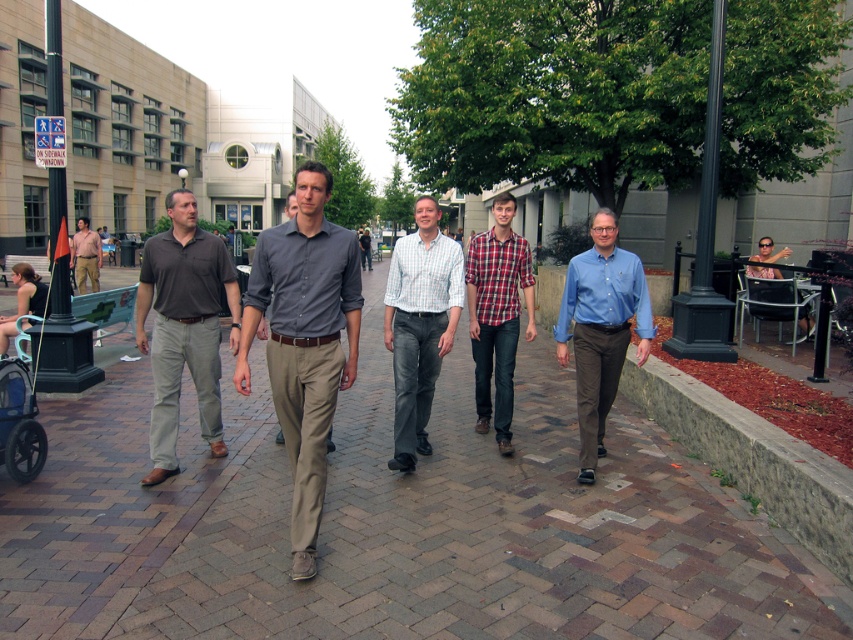
Can you confirm if brick pavement at center is thinner than plaid cotton shirt at center?

In fact, brick pavement at center might be wider than plaid cotton shirt at center.

This screenshot has width=853, height=640. What do you see at coordinates (393, 524) in the screenshot?
I see `brick pavement at center` at bounding box center [393, 524].

Which is in front, point (567, 412) or point (482, 244)?

Point (482, 244)

You are a GUI agent. You are given a task and a screenshot of the screen. Output one action in this format:
    pyautogui.click(x=<x>, y=<y>)
    Task: Click on the brick pavement at center
    The image size is (853, 640).
    Given the screenshot: What is the action you would take?
    pyautogui.click(x=393, y=524)

Is brick pavement at center positioned at the back of blue plastic baby carriage at lower left?

No, it is in front of blue plastic baby carriage at lower left.

Can you confirm if brick pavement at center is positioned above blue plastic baby carriage at lower left?

Indeed, brick pavement at center is positioned over blue plastic baby carriage at lower left.

Who is more forward, (x=462, y=424) or (x=4, y=364)?

Point (x=4, y=364) is in front.

This screenshot has width=853, height=640. In order to click on brick pavement at center in this screenshot , I will do `click(393, 524)`.

Describe the element at coordinates (497, 314) in the screenshot. I see `plaid cotton shirt at center` at that location.

Is plaid cotton shirt at center wider than matte brown shirt at left?

No, plaid cotton shirt at center is not wider than matte brown shirt at left.

Is point (498, 228) farther from camera compared to point (90, 266)?

No.

This screenshot has width=853, height=640. I want to click on plaid cotton shirt at center, so click(497, 314).